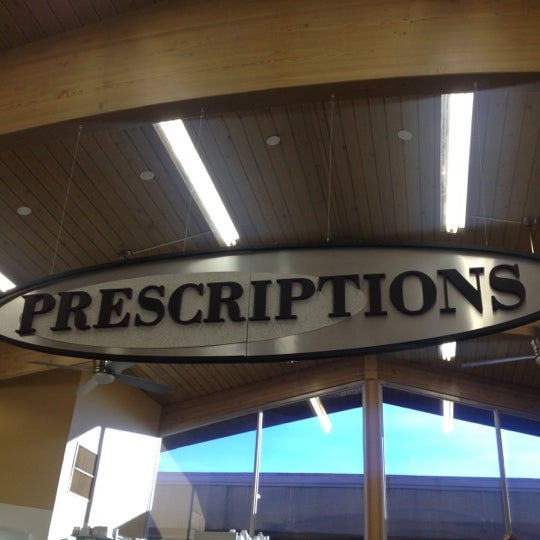
At what (x,y) coordinates should I click in order to perform the action: click on sunlit portion of interior wall. Please return your answer as a coordinate pair (x, y). This screenshot has height=540, width=540. Looking at the image, I should click on (125, 469).